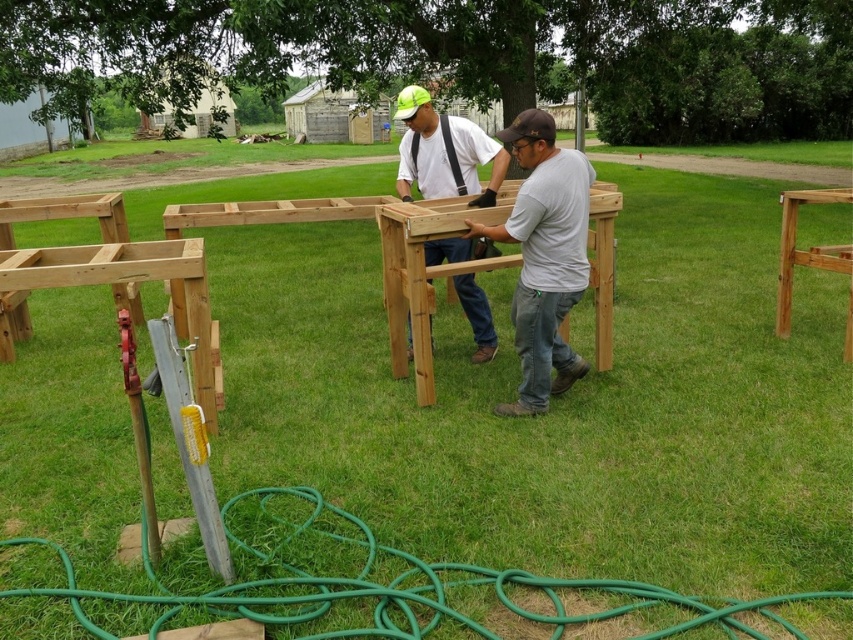
You are a visitor observing two men working on a project in a grassy area. You see the green rubber hose at lower center and the natural wood frame at left. Which object is positioned lower in the scene?

The green rubber hose at lower center is positioned below the natural wood frame at left, so it is lower in the scene.

Consider the image. You are a visitor observing two men working on a project in the outdoor scene. You see the matte wood construction at center and the light brown wood at right. Which object is positioned to the left?

The matte wood construction at center is positioned to the left of the light brown wood at right.

You are a construction worker who needs to choose between the green rubber hose at lower center and the gray matte shirt at center for a task requiring a wider object. Which object should you select?

The green rubber hose at lower center has a larger width than the gray matte shirt at center, so you should select the green rubber hose at lower center for the task requiring a wider object.